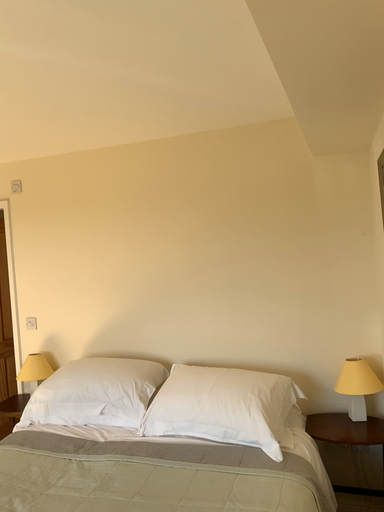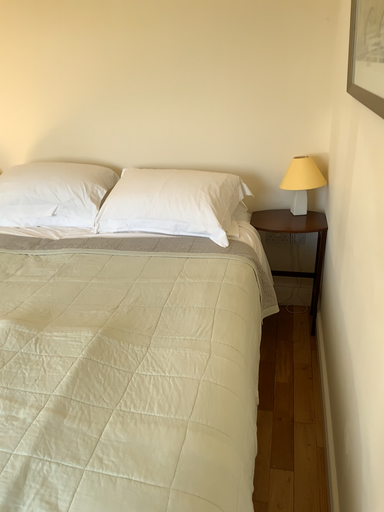
Question: Which way did the camera rotate in the video?

Choices:
 (A) rotated right
 (B) rotated left

Answer: (A)